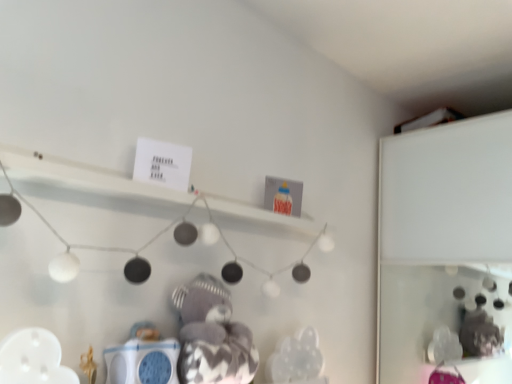
Image resolution: width=512 pixels, height=384 pixels. Describe the element at coordinates (212, 335) in the screenshot. I see `fluffy gray teddy bear at center` at that location.

Where is `fluffy gray teddy bear at center`? The height and width of the screenshot is (384, 512). fluffy gray teddy bear at center is located at coordinates (212, 335).

The image size is (512, 384). I want to click on fluffy gray teddy bear at center, so click(212, 335).